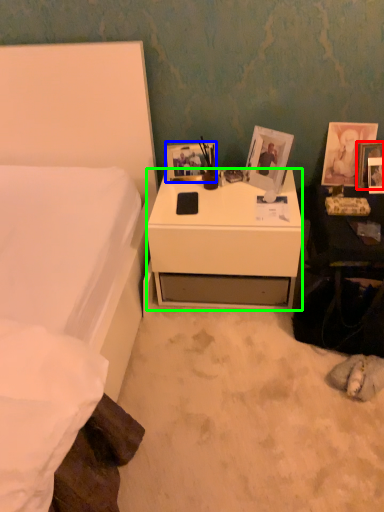
Question: Estimate the real-world distances between objects in this image. Which object is farther from picture frame (highlighted by a red box), picture frame (highlighted by a blue box) or desk (highlighted by a green box)?

Choices:
 (A) picture frame
 (B) desk

Answer: (A)